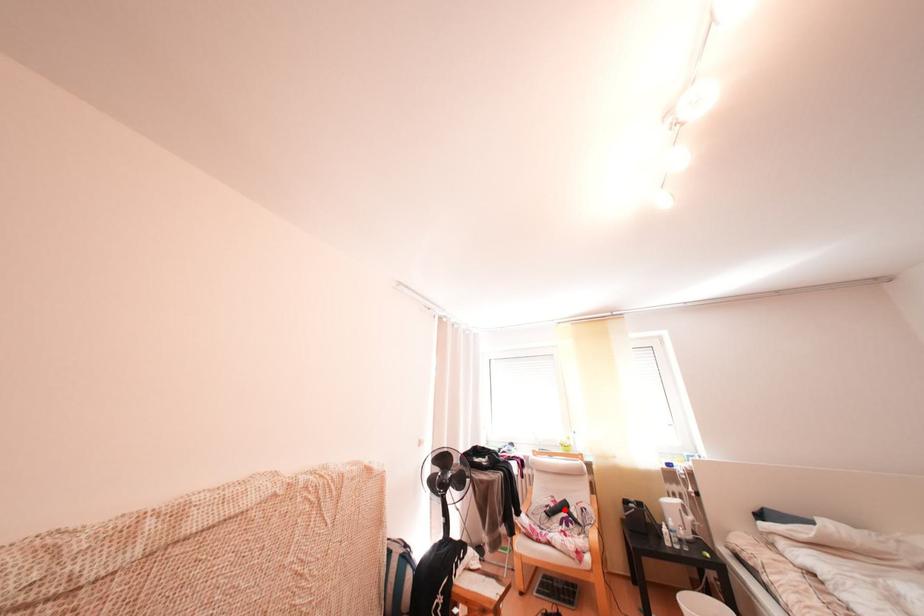
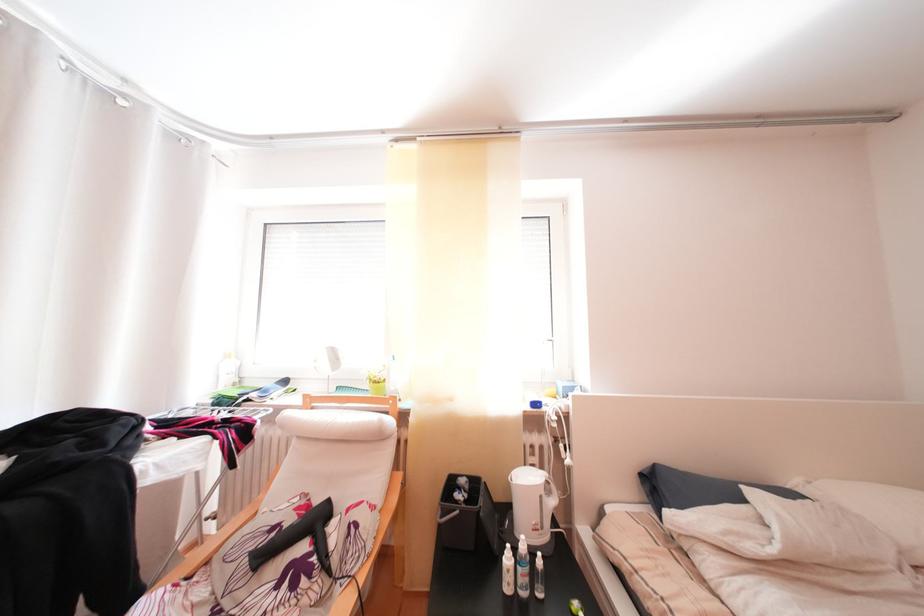
Question: I am providing you with two images of the same scene from different viewpoints. In image1, a red point is highlighted. Considering the same 3D point in image2, which of the following is correct?

Choices:
 (A) It is closer
 (B) It is farther

Answer: (A)